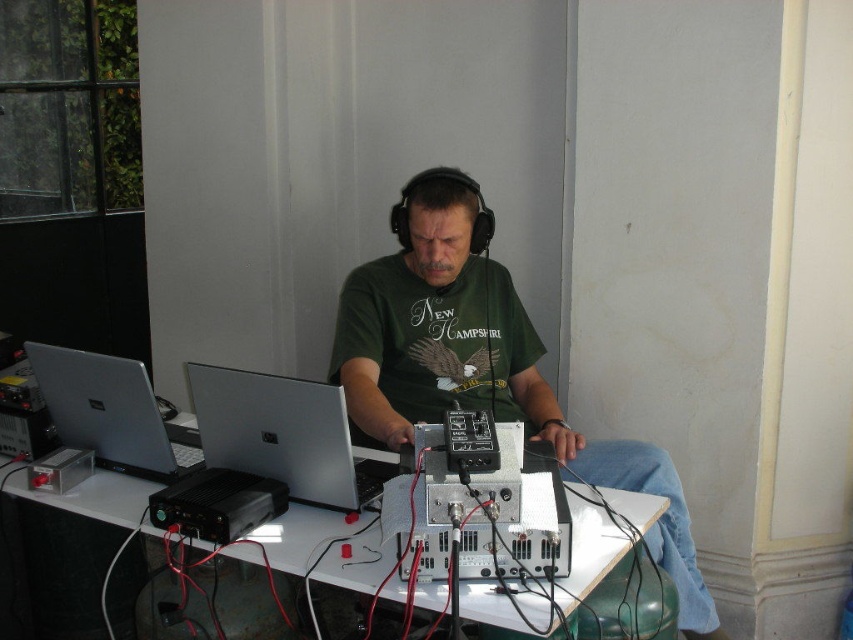
Question: Which point is farther to the camera?

Choices:
 (A) (431, 221)
 (B) (212, 465)

Answer: (A)

Question: Is silver metallic laptop at center to the right of silver metallic laptop at left from the viewer's perspective?

Choices:
 (A) no
 (B) yes

Answer: (B)

Question: Estimate the real-world distances between objects in this image. Which object is farther from the silver metallic laptop at center?

Choices:
 (A) white plastic table at center
 (B) silver metallic laptop at left
 (C) green matte shirt at center

Answer: (C)

Question: Which point is farther from the camera taking this photo?

Choices:
 (A) (404, 224)
 (B) (351, 564)
 (C) (119, 442)
 (D) (268, 435)

Answer: (A)

Question: Does white plastic table at center have a lesser width compared to silver metallic laptop at left?

Choices:
 (A) no
 (B) yes

Answer: (A)

Question: Does white plastic table at center have a greater width compared to silver metallic laptop at center?

Choices:
 (A) no
 (B) yes

Answer: (B)